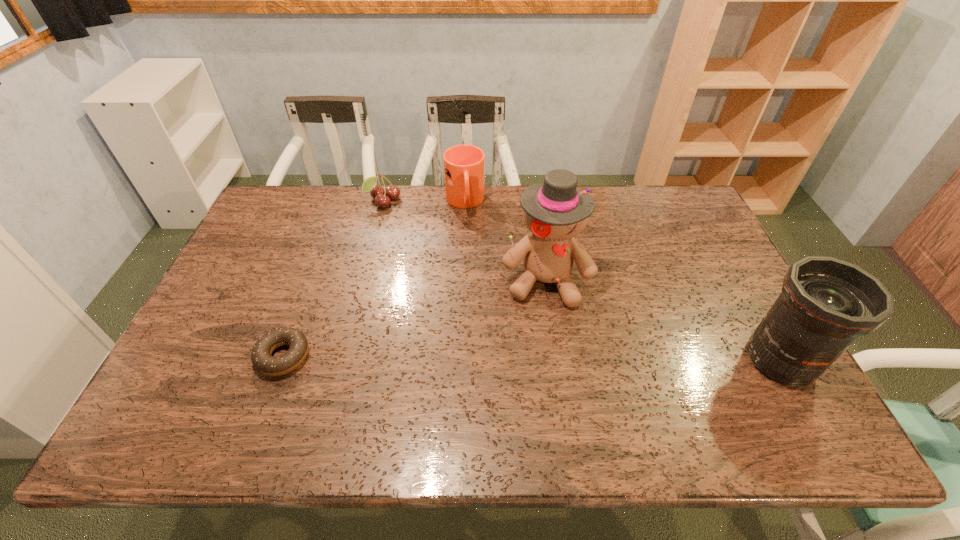
You are a GUI agent. You are given a task and a screenshot of the screen. Output one action in this format:
    pyautogui.click(x=<x>, y=<y>)
    Task: Click on the vacant space located 0.090m on the leaves of the second object from left to right
    Image resolution: width=960 pixels, height=540 pixels.
    Given the screenshot: What is the action you would take?
    pyautogui.click(x=401, y=224)

Image resolution: width=960 pixels, height=540 pixels. What are the coordinates of `mug at the far edge` in the screenshot? It's located at (464, 165).

Locate an element on the screen. cherry that is at the far edge is located at coordinates (382, 198).

This screenshot has height=540, width=960. Identify the location of doughnut that is at the near edge. (261, 358).

In order to click on telephoto lens that is at the near edge in this screenshot , I will do coord(826,303).

This screenshot has width=960, height=540. I want to click on object that is at the right edge, so click(826, 303).

You are a GUI agent. You are given a task and a screenshot of the screen. Output one action in this format:
    pyautogui.click(x=<x>, y=<y>)
    Task: Click on the object located at the near right corner
    
    Given the screenshot: What is the action you would take?
    pyautogui.click(x=826, y=303)

Find the location of `free space at the far edge`. free space at the far edge is located at coordinates (482, 204).

The height and width of the screenshot is (540, 960). I want to click on vacant space at the near edge, so click(233, 392).

In the image, there is a desktop. At what (x,y) coordinates should I click in order to perform the action: click on vacant space at the right edge. Please return your answer as a coordinate pair (x, y). Image resolution: width=960 pixels, height=540 pixels. Looking at the image, I should click on (707, 245).